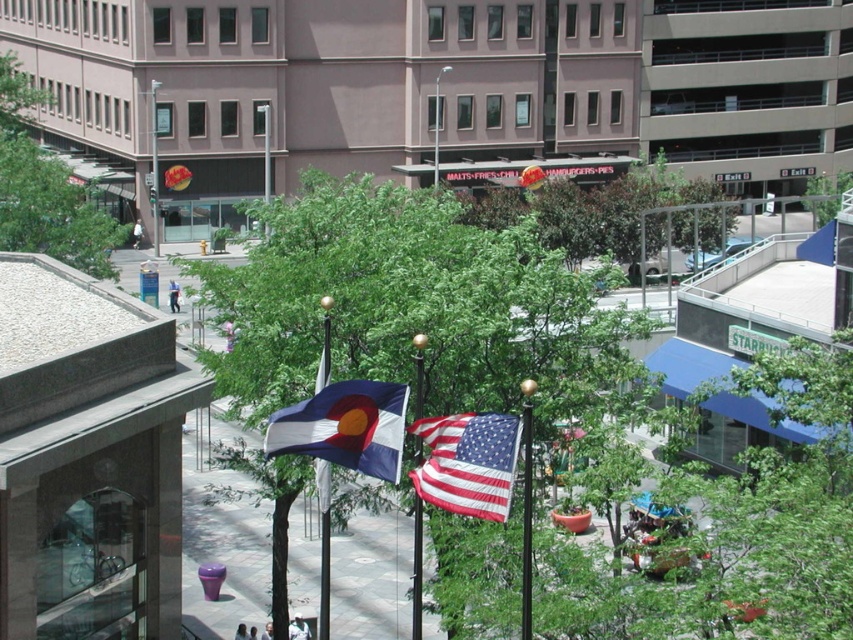
You are standing on a balcony and see the blue fabric flag at center and the metallic flagpole at center. Can you tell me which object is higher from the ground?

The blue fabric flag at center is located above the metallic flagpole at center, so the blue fabric flag at center is higher from the ground than the metallic flagpole at center.

You are standing on a balcony overlooking the urban scene. You see two green leafy trees in the distance. Which tree, the green leafy tree at upper left or the green leafy tree at center, appears closer to you?

The green leafy tree at upper left appears closer to you because it is located above the green leafy tree at center, indicating it is in a higher position relative to your viewpoint.